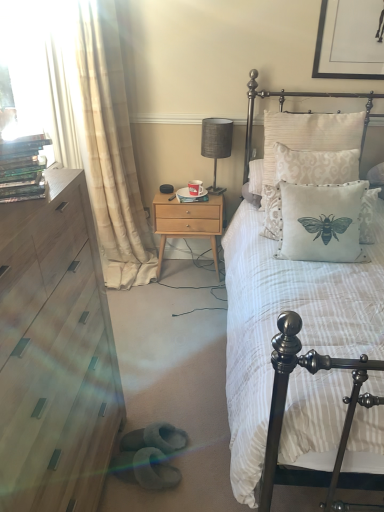
What is the approximate height of beige fabric curtain at left?

beige fabric curtain at left is 5.91 feet tall.

Describe the element at coordinates (100, 134) in the screenshot. The image size is (384, 512). I see `beige fabric curtain at left` at that location.

Locate an element on the screen. This screenshot has width=384, height=512. creamy beige fabric pillow at upper right, which is counted as the 2th pillow, starting from the bottom is located at coordinates (315, 166).

Locate an element on the screen. silk-patterned pillow at upper right is located at coordinates (296, 96).

Describe the element at coordinates (29, 68) in the screenshot. I see `transparent plastic dvds at left` at that location.

The width and height of the screenshot is (384, 512). What do you see at coordinates (55, 353) in the screenshot?
I see `light wood chest of drawers at left` at bounding box center [55, 353].

Identify the location of beige fabric curtain at left. (100, 134).

Is light wood/texture nightstand at center wider than light wood chest of drawers at left?

Incorrect, the width of light wood/texture nightstand at center does not surpass that of light wood chest of drawers at left.

Is light wood/texture nightstand at center positioned with its back to light wood chest of drawers at left?

light wood/texture nightstand at center does not have its back to light wood chest of drawers at left.

At what (x,y) coordinates should I click in order to perform the action: click on chest of drawers above the light wood/texture nightstand at center (from a real-world perspective). Please return your answer as a coordinate pair (x, y). This screenshot has height=512, width=384. Looking at the image, I should click on (55, 353).

From the image's perspective, would you say light wood/texture nightstand at center is shown under light wood chest of drawers at left?

No, from the image's perspective, light wood/texture nightstand at center is not beneath light wood chest of drawers at left.

Considering the positions of points (279, 172) and (162, 232), is point (279, 172) closer to camera compared to point (162, 232)?

Yes, point (279, 172) is in front of point (162, 232).

Which is correct: creamy beige fabric pillow at upper right, which is counted as the 2th pillow, starting from the bottom, is inside light wood/texture nightstand at center, or outside of it?

creamy beige fabric pillow at upper right, which is counted as the 2th pillow, starting from the bottom, is not inside light wood/texture nightstand at center, it's outside.

Between creamy beige fabric pillow at upper right, which is counted as the 2th pillow, starting from the bottom, and light wood/texture nightstand at center, which one has smaller size?

With smaller size is creamy beige fabric pillow at upper right, which is counted as the 2th pillow, starting from the bottom.

From the image's perspective, who appears lower, creamy beige fabric pillow at upper right, which is the first pillow from top to bottom, or light wood/texture nightstand at center?

light wood/texture nightstand at center appears lower in the image.

Does silk-patterned pillow at upper right appear on the right side of white fabric pillow with bee design at center, the 2th pillow from the top?

Correct, you'll find silk-patterned pillow at upper right to the right of white fabric pillow with bee design at center, the 2th pillow from the top.

How distant is silk-patterned pillow at upper right from white fabric pillow with bee design at center, the first pillow ordered from the bottom?

29.61 inches.

Identify the location of pillow directly beneath the silk-patterned pillow at upper right (from a real-world perspective). (321, 222).

Which point is more distant from viewer, (369, 117) or (351, 229)?

The point (369, 117) is behind.

From the image's perspective, which one is positioned higher, creamy beige fabric pillow at upper right, which is counted as the 2th pillow, starting from the bottom, or transparent plastic dvds at left?

transparent plastic dvds at left, from the image's perspective.

Does creamy beige fabric pillow at upper right, which is the first pillow from top to bottom, have a lesser width compared to transparent plastic dvds at left?

Incorrect, the width of creamy beige fabric pillow at upper right, which is the first pillow from top to bottom, is not less than that of transparent plastic dvds at left.

From a real-world perspective, starting from the transparent plastic dvds at left, which pillow is the 1st one below it? Please provide its 2D coordinates.

[(315, 166)]

Is light wood chest of drawers at left oriented towards white fabric pillow with bee design at center, the 2th pillow from the top?

No, light wood chest of drawers at left is not facing towards white fabric pillow with bee design at center, the 2th pillow from the top.

How far apart are light wood chest of drawers at left and white fabric pillow with bee design at center, the 2th pillow from the top?

light wood chest of drawers at left and white fabric pillow with bee design at center, the 2th pillow from the top, are 1.11 meters apart.

Does light wood chest of drawers at left have a greater width compared to white fabric pillow with bee design at center, the 2th pillow from the top?

Yes.

Does light wood/texture nightstand at center touch matte gray fabric table lamp at center?

No.

How many degrees apart are the facing directions of light wood/texture nightstand at center and matte gray fabric table lamp at center?

The angle between the facing direction of light wood/texture nightstand at center and the facing direction of matte gray fabric table lamp at center is 89.4 degrees.

Locate an element on the screen. The height and width of the screenshot is (512, 384). nightstand below the matte gray fabric table lamp at center (from the image's perspective) is located at coordinates (187, 222).

Based on the photo, does light wood/texture nightstand at center have a greater width compared to matte gray fabric table lamp at center?

Indeed, light wood/texture nightstand at center has a greater width compared to matte gray fabric table lamp at center.

Does hardcover books at left turn towards transparent plastic dvds at left?

No, hardcover books at left is not turned towards transparent plastic dvds at left.

Which object is positioned more to the right, hardcover books at left or transparent plastic dvds at left?

hardcover books at left is more to the right.

Is hardcover books at left closer to the viewer compared to transparent plastic dvds at left?

Yes, the depth of hardcover books at left is less than that of transparent plastic dvds at left.

From the image's perspective, who appears lower, hardcover books at left or transparent plastic dvds at left?

From the image's view, hardcover books at left is below.

Where is `nightstand below the light wood chest of drawers at left (from a real-world perspective)`? The width and height of the screenshot is (384, 512). nightstand below the light wood chest of drawers at left (from a real-world perspective) is located at coordinates (187, 222).

The height and width of the screenshot is (512, 384). I want to click on nightstand below the creamy beige fabric pillow at upper right, which is counted as the 2th pillow, starting from the bottom (from the image's perspective), so click(x=187, y=222).

Based on the photo, estimate the real-world distances between objects in this image. Which object is closer to matte gray fabric table lamp at center, white striped fabric bed at center or light wood/texture nightstand at center?

light wood/texture nightstand at center.

When comparing their distances from hardcover books at left, does white fabric pillow with bee design at center, the first pillow ordered from the bottom, or silk-patterned pillow at upper right seem further?

silk-patterned pillow at upper right is positioned further to the anchor hardcover books at left.

Estimate the real-world distances between objects in this image. Which object is further from creamy beige fabric pillow at upper right, which is the first pillow from top to bottom, matte gray fabric table lamp at center or hardcover books at left?

Based on the image, hardcover books at left appears to be further to creamy beige fabric pillow at upper right, which is the first pillow from top to bottom.

When comparing their distances from creamy beige fabric pillow at upper right, which is the first pillow from top to bottom, does beige fabric curtain at left or white fabric pillow with bee design at center, the 2th pillow from the top, seem closer?

Based on the image, white fabric pillow with bee design at center, the 2th pillow from the top, appears to be nearer to creamy beige fabric pillow at upper right, which is the first pillow from top to bottom.

Based on their spatial positions, is transparent plastic dvds at left or creamy beige fabric pillow at upper right, which is counted as the 2th pillow, starting from the bottom, further from beige fabric curtain at left?

creamy beige fabric pillow at upper right, which is counted as the 2th pillow, starting from the bottom.

Which object lies further to the anchor point hardcover books at left, creamy beige fabric pillow at upper right, which is the first pillow from top to bottom, or silk-patterned pillow at upper right?

Among the two, silk-patterned pillow at upper right is located further to hardcover books at left.

Considering their positions, is silk-patterned pillow at upper right positioned closer to light wood/texture nightstand at center than white fabric pillow with bee design at center, the first pillow ordered from the bottom?

The object closer to light wood/texture nightstand at center is silk-patterned pillow at upper right.

Considering their positions, is creamy beige fabric pillow at upper right, which is the first pillow from top to bottom, positioned further to white fabric pillow with bee design at center, the 2th pillow from the top, than light wood chest of drawers at left?

light wood chest of drawers at left.

The width and height of the screenshot is (384, 512). Identify the location of table lamp between hardcover books at left and light wood/texture nightstand at center along the z-axis. (216, 144).

Image resolution: width=384 pixels, height=512 pixels. In order to click on curtain between transparent plastic dvds at left and white fabric pillow with bee design at center, the 2th pillow from the top, from left to right in this screenshot , I will do `click(100, 134)`.

In order to click on nightstand between transparent plastic dvds at left and white fabric pillow with bee design at center, the 2th pillow from the top, from left to right in this screenshot , I will do `click(187, 222)`.

Where is `curtain between white striped fabric bed at center and silk-patterned pillow at upper right in the front-back direction`? Image resolution: width=384 pixels, height=512 pixels. curtain between white striped fabric bed at center and silk-patterned pillow at upper right in the front-back direction is located at coordinates (100, 134).